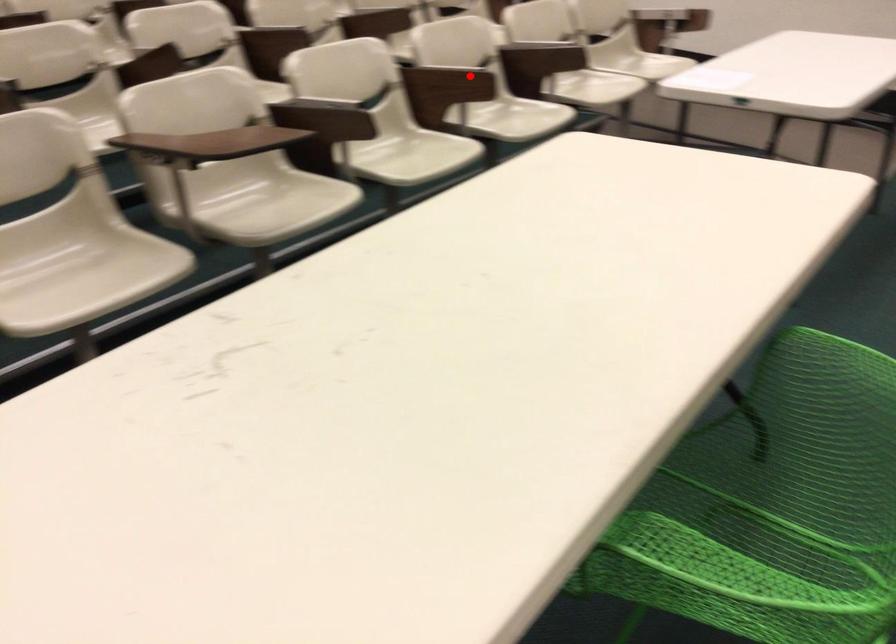
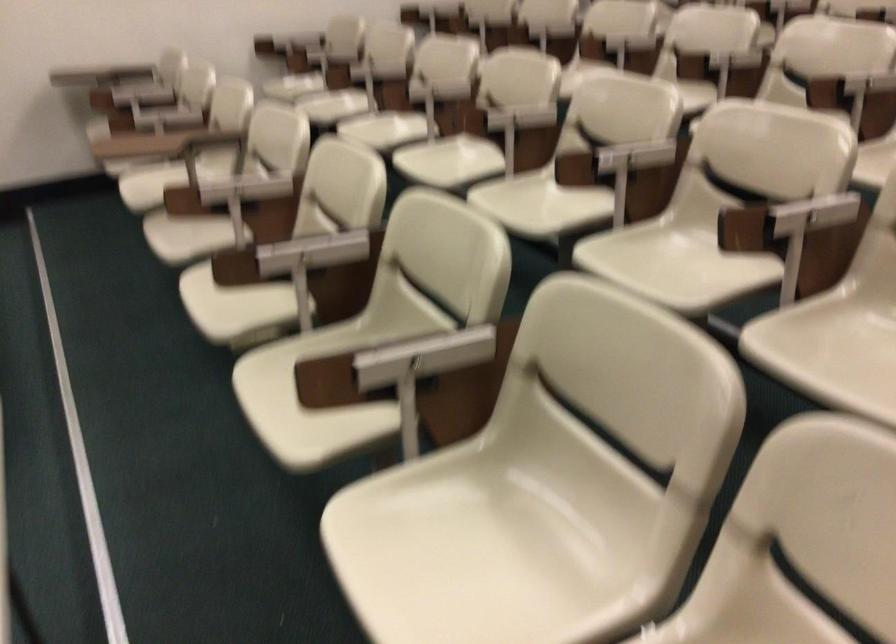
The point at the highlighted location is marked in the first image. Where is the corresponding point in the second image?

(290, 256)